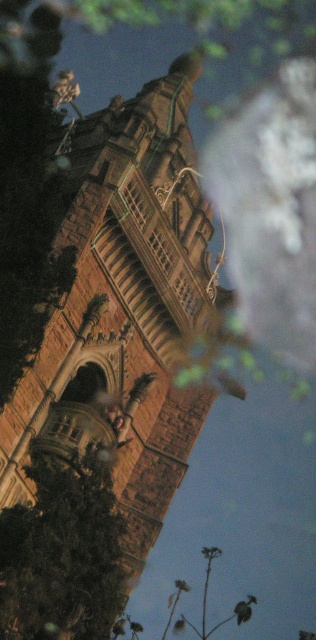
Which is in front, point (93, 189) or point (29, 625)?

Point (29, 625) is in front.

Which is behind, point (134, 228) or point (32, 582)?

The point (134, 228) is behind.

Is point (174, 83) positioned behind point (89, 474)?

That is True.

Image resolution: width=316 pixels, height=640 pixels. I want to click on brown stone tower at center, so click(x=122, y=312).